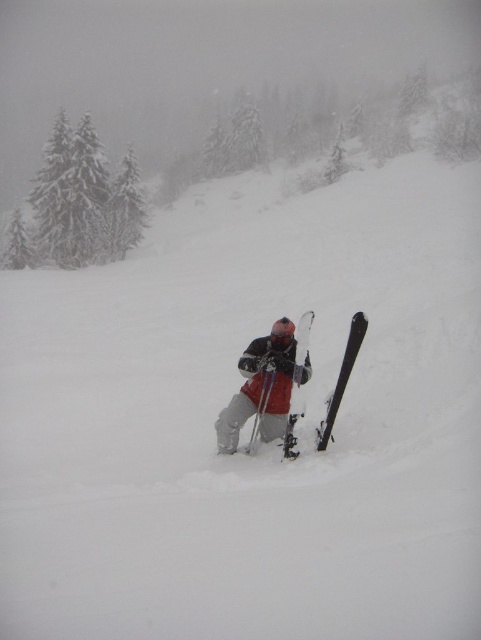
Question: Can you confirm if matte gray ski suit at center is positioned above black matte ski at lower center?

Choices:
 (A) no
 (B) yes

Answer: (A)

Question: Which object is the closest to the matte black ski at center?

Choices:
 (A) black matte ski at lower center
 (B) matte gray ski suit at center

Answer: (B)

Question: Is matte gray ski suit at center further to camera compared to black matte ski at lower center?

Choices:
 (A) no
 (B) yes

Answer: (B)

Question: Is the position of matte gray ski suit at center less distant than that of black matte ski at lower center?

Choices:
 (A) yes
 (B) no

Answer: (B)

Question: Which object is the closest to the black matte ski at lower center?

Choices:
 (A) matte black ski at center
 (B) matte gray ski suit at center

Answer: (A)

Question: Which object is positioned farthest from the matte black ski at center?

Choices:
 (A) matte gray ski suit at center
 (B) black matte ski at lower center

Answer: (B)